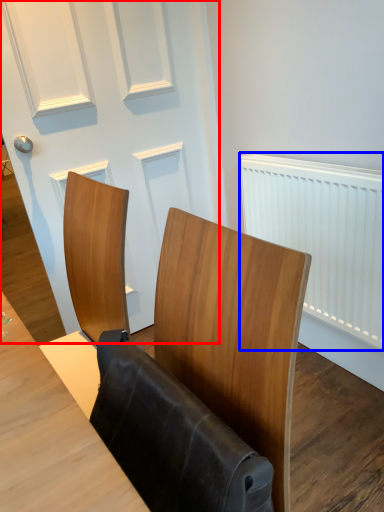
Question: Which of the following is the closest to the observer, door (highlighted by a red box) or radiator (highlighted by a blue box)?

Choices:
 (A) door
 (B) radiator

Answer: (B)